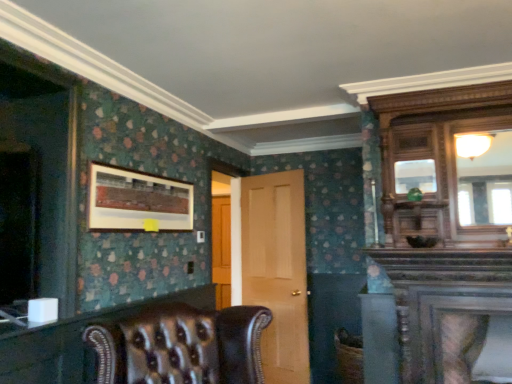
Question: Does light brown wood door at center contain wooden-framed artwork at upper left?

Choices:
 (A) yes
 (B) no

Answer: (B)

Question: Can you confirm if light brown wood door at center is positioned to the right of wooden-framed artwork at upper left?

Choices:
 (A) no
 (B) yes

Answer: (B)

Question: Considering the relative sizes of light brown wood door at center and wooden-framed artwork at upper left in the image provided, is light brown wood door at center taller than wooden-framed artwork at upper left?

Choices:
 (A) no
 (B) yes

Answer: (B)

Question: Is light brown wood door at center not inside wooden-framed artwork at upper left?

Choices:
 (A) yes
 (B) no

Answer: (A)

Question: Can you confirm if light brown wood door at center is smaller than wooden-framed artwork at upper left?

Choices:
 (A) no
 (B) yes

Answer: (A)

Question: From the image's perspective, is light brown wood door at center positioned above or below leather armchair at center?

Choices:
 (A) above
 (B) below

Answer: (A)

Question: Is light brown wood door at center taller or shorter than leather armchair at center?

Choices:
 (A) tall
 (B) short

Answer: (A)

Question: Does point (290, 183) appear closer or farther from the camera than point (260, 319)?

Choices:
 (A) closer
 (B) farther

Answer: (B)

Question: From a real-world perspective, relative to leather armchair at center, is light brown wood door at center vertically above or below?

Choices:
 (A) above
 (B) below

Answer: (A)

Question: Looking at their shapes, would you say leather at lower left, the 1th dresser positioned from the left, is wider or thinner than wooden-framed artwork at upper left?

Choices:
 (A) wide
 (B) thin

Answer: (A)

Question: Is leather at lower left, which ranks as the second dresser in right-to-left order, in front of or behind wooden-framed artwork at upper left in the image?

Choices:
 (A) behind
 (B) front

Answer: (B)

Question: Would you say leather at lower left, which ranks as the second dresser in right-to-left order, is to the left or to the right of wooden-framed artwork at upper left in the picture?

Choices:
 (A) right
 (B) left

Answer: (B)

Question: From the image's perspective, is leather at lower left, the 1th dresser positioned from the left, located above or below wooden-framed artwork at upper left?

Choices:
 (A) above
 (B) below

Answer: (B)

Question: Relative to light brown wood door at center, is leather armchair at center in front or behind?

Choices:
 (A) behind
 (B) front

Answer: (B)

Question: From the image's perspective, is leather armchair at center located above or below light brown wood door at center?

Choices:
 (A) below
 (B) above

Answer: (A)